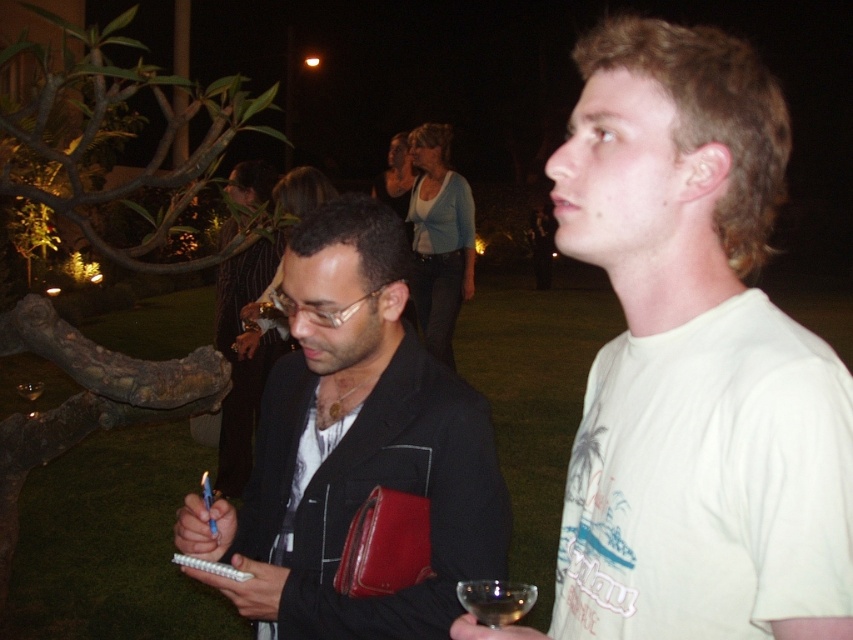
You are standing in the garden at night and see two points marked in the image. The first point is at coordinates point (759,314) and the second is at point (231,588). Which point is closer to you?

Point (759,314) is closer to the viewer than point (231,588).